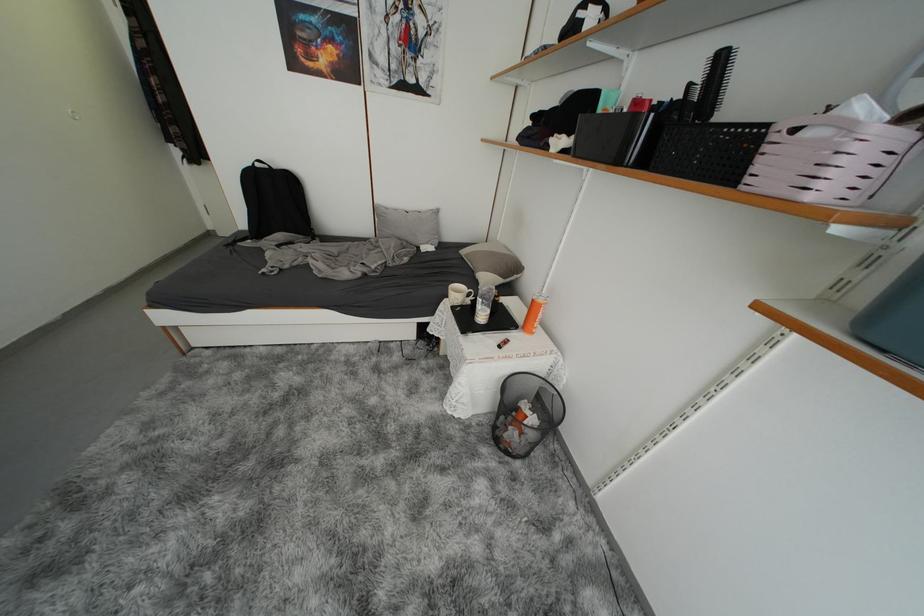
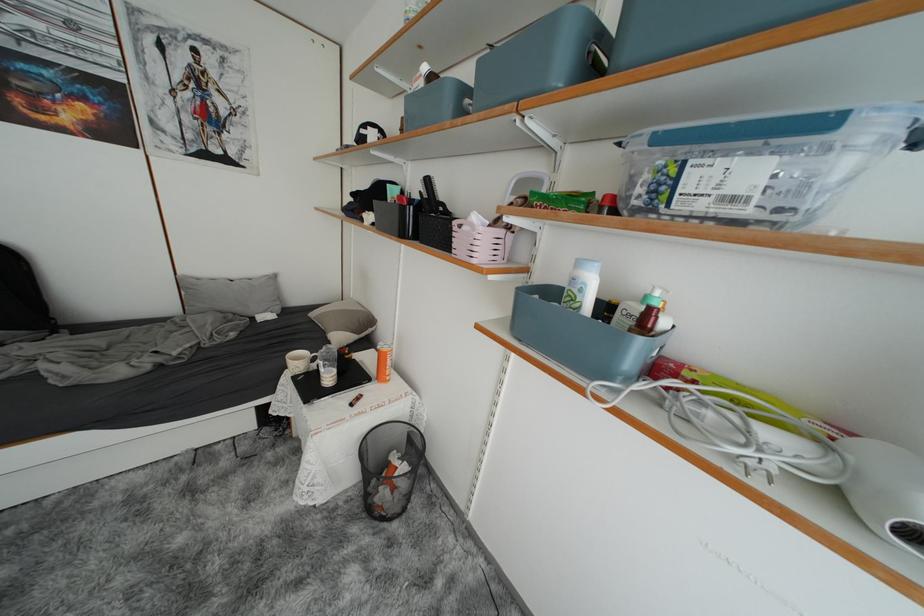
Where in the second image is the point corresponding to the point at 464,297 from the first image?

(305, 365)